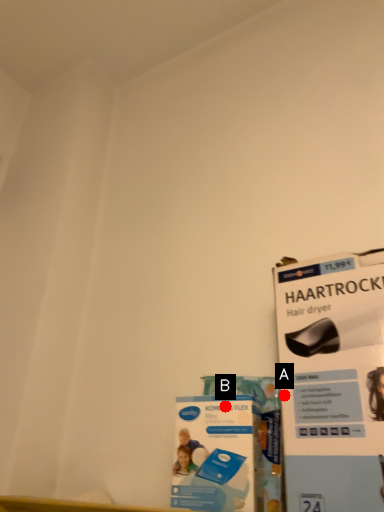
Question: Two points are circled on the image, labeled by A and B beside each circle. Which point is closer to the camera taking this photo?

Choices:
 (A) A is closer
 (B) B is closer

Answer: (A)